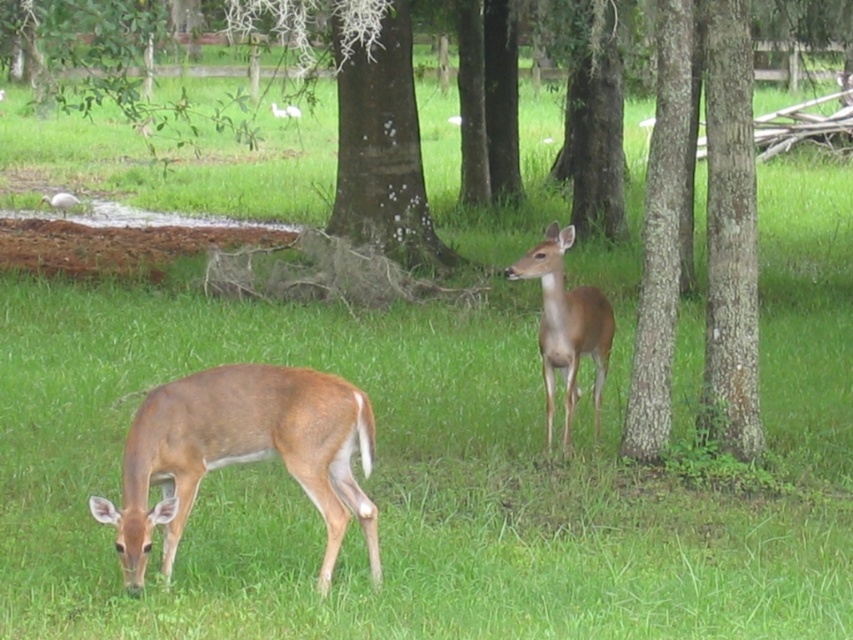
Question: Which point is closer to the camera?

Choices:
 (A) (164, 580)
 (B) (68, 208)
 (C) (579, 339)

Answer: (A)

Question: Based on their relative distances, which object is nearer to the brown matte/deer at center-right?

Choices:
 (A) brown matte/deer at lower left
 (B) white matte bird at upper left

Answer: (A)

Question: Does brown matte/deer at lower left have a smaller size compared to white matte bird at upper left?

Choices:
 (A) yes
 (B) no

Answer: (B)

Question: Estimate the real-world distances between objects in this image. Which object is closer to the brown matte/deer at lower left?

Choices:
 (A) white matte bird at upper left
 (B) brown matte/deer at center-right

Answer: (B)

Question: Does brown matte/deer at lower left appear on the right side of brown matte/deer at center-right?

Choices:
 (A) yes
 (B) no

Answer: (B)

Question: Does brown matte/deer at lower left appear over white matte bird at upper left?

Choices:
 (A) no
 (B) yes

Answer: (A)